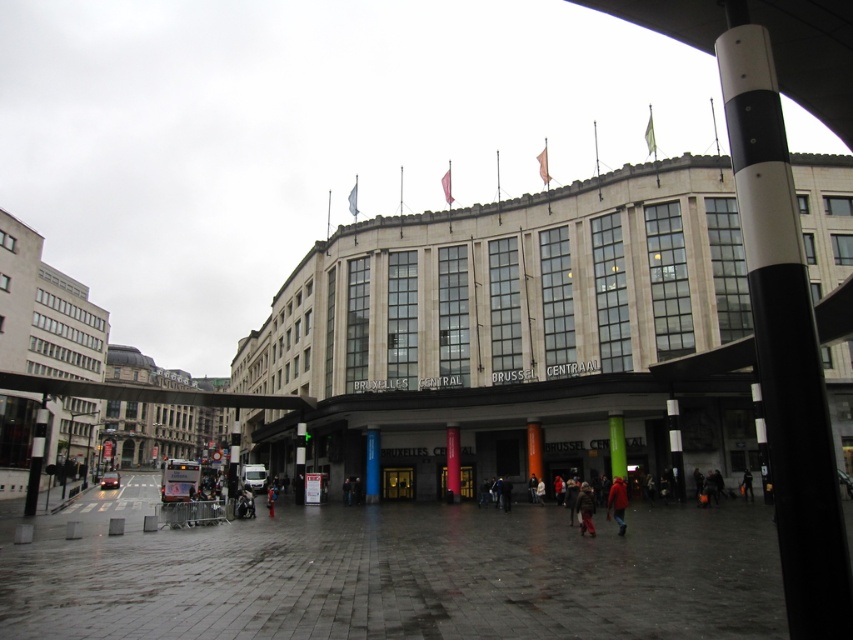
You are standing at the Brussels Central Station plaza and see a black and white striped pole at upper right and a red wool coat at lower center. Which object is positioned higher in the image?

The black and white striped pole at upper right is positioned higher in the image than the red wool coat at lower center.

You are a photographer standing in front of the beige stone building at center and the black and white striped pole at upper right. You want to capture both subjects in a single frame. Given that your camera can only focus on one subject at a time, which subject should you prioritize focusing on to ensure it appears sharp in the photo?

The beige stone building at center should be prioritized for focus because it is taller than the black and white striped pole at upper right, making it more prominent in the frame.

You are standing in front of Brussels Central Station and want to take a photo. You notice two points marked on the ground at coordinates point (366,342) and point (784,326). Which point is closer to you as you stand facing the station?

Point (366,342) is closer to you because it is further to the viewer than point (784,326).